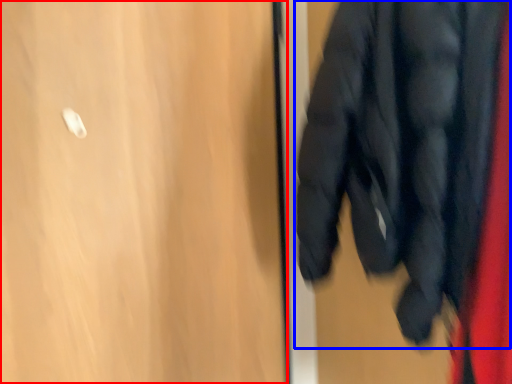
Question: Which object is further to the camera taking this photo, door (highlighted by a red box) or jacket (highlighted by a blue box)?

Choices:
 (A) door
 (B) jacket

Answer: (A)